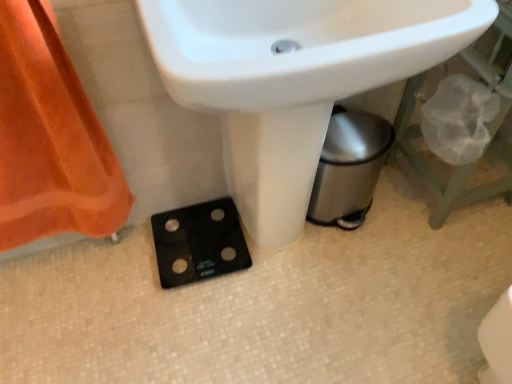
Question: Considering the relative sizes of black glass scale at lower center and orange fabric at left in the image provided, is black glass scale at lower center thinner than orange fabric at left?

Choices:
 (A) no
 (B) yes

Answer: (A)

Question: Is black glass scale at lower center surrounding orange fabric at left?

Choices:
 (A) yes
 (B) no

Answer: (B)

Question: Can you confirm if black glass scale at lower center is positioned to the left of orange fabric at left?

Choices:
 (A) yes
 (B) no

Answer: (B)

Question: Is black glass scale at lower center outside orange fabric at left?

Choices:
 (A) yes
 (B) no

Answer: (A)

Question: Could you tell me if black glass scale at lower center is turned towards orange fabric at left?

Choices:
 (A) no
 (B) yes

Answer: (A)

Question: Looking at their shapes, would you say white glossy sink at center is wider or thinner than black glass scale at lower center?

Choices:
 (A) wide
 (B) thin

Answer: (A)

Question: From a real-world perspective, is white glossy sink at center physically located above or below black glass scale at lower center?

Choices:
 (A) below
 (B) above

Answer: (B)

Question: Does point (256, 132) appear closer or farther from the camera than point (227, 203)?

Choices:
 (A) closer
 (B) farther

Answer: (A)

Question: From the image's perspective, is white glossy sink at center above or below black glass scale at lower center?

Choices:
 (A) below
 (B) above

Answer: (B)

Question: Do you think white glossy sink at center is within orange fabric at left, or outside of it?

Choices:
 (A) inside
 (B) outside

Answer: (B)

Question: In terms of height, does white glossy sink at center look taller or shorter compared to orange fabric at left?

Choices:
 (A) tall
 (B) short

Answer: (A)

Question: Is white glossy sink at center wider or thinner than orange fabric at left?

Choices:
 (A) thin
 (B) wide

Answer: (B)

Question: Is white glossy sink at center to the left or to the right of orange fabric at left in the image?

Choices:
 (A) right
 (B) left

Answer: (A)

Question: From a real-world perspective, is orange fabric at left physically located above or below white glossy sink at center?

Choices:
 (A) below
 (B) above

Answer: (A)

Question: Would you say orange fabric at left is inside or outside white glossy sink at center?

Choices:
 (A) outside
 (B) inside

Answer: (A)